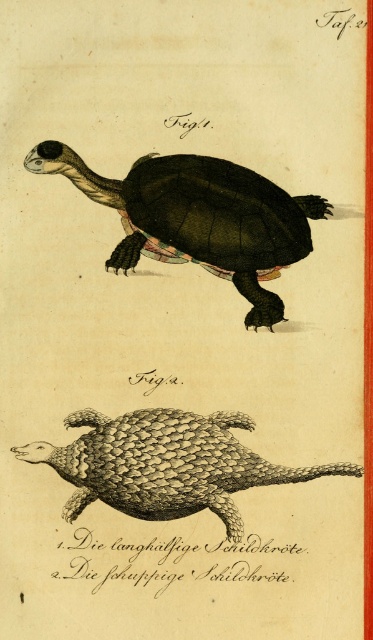
Question: Does matte black turtle at center appear on the left side of shiny scaly pangolin at bottom center?

Choices:
 (A) yes
 (B) no

Answer: (A)

Question: Which point appears farthest from the camera in this image?

Choices:
 (A) (186, 193)
 (B) (214, 452)

Answer: (A)

Question: Can you confirm if matte black turtle at center is thinner than shiny scaly pangolin at bottom center?

Choices:
 (A) no
 (B) yes

Answer: (B)

Question: Does matte black turtle at center come in front of shiny scaly pangolin at bottom center?

Choices:
 (A) no
 (B) yes

Answer: (B)